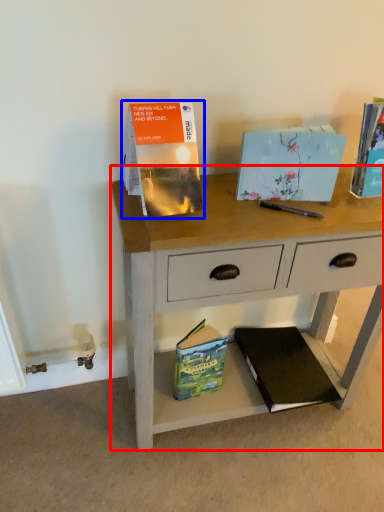
Question: Which point is closer to the camera, desk (highlighted by a red box) or paperback book (highlighted by a blue box)?

Choices:
 (A) desk
 (B) paperback book

Answer: (B)